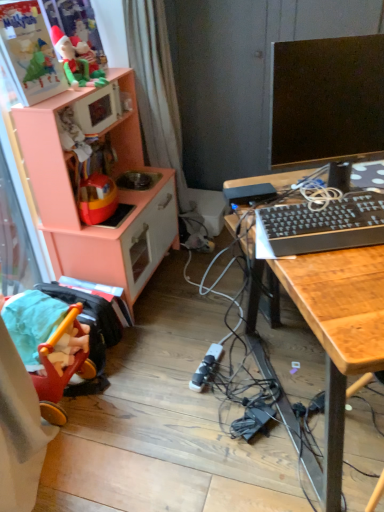
At what (x,y) coordinates should I click in order to perform the action: click on vacant space behind black plastic plug at center. Please return your answer as a coordinate pair (x, y). This screenshot has height=512, width=384. Looking at the image, I should click on (192, 338).